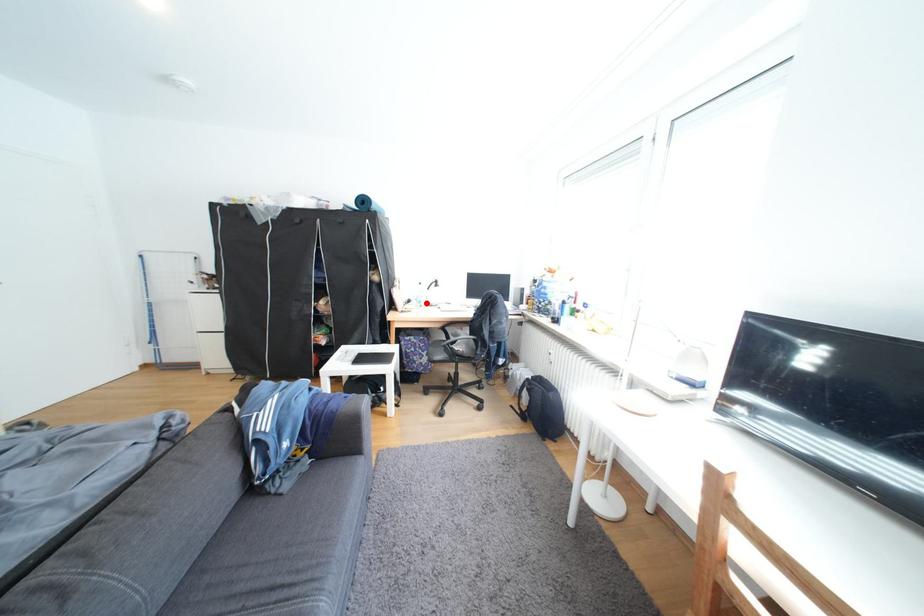
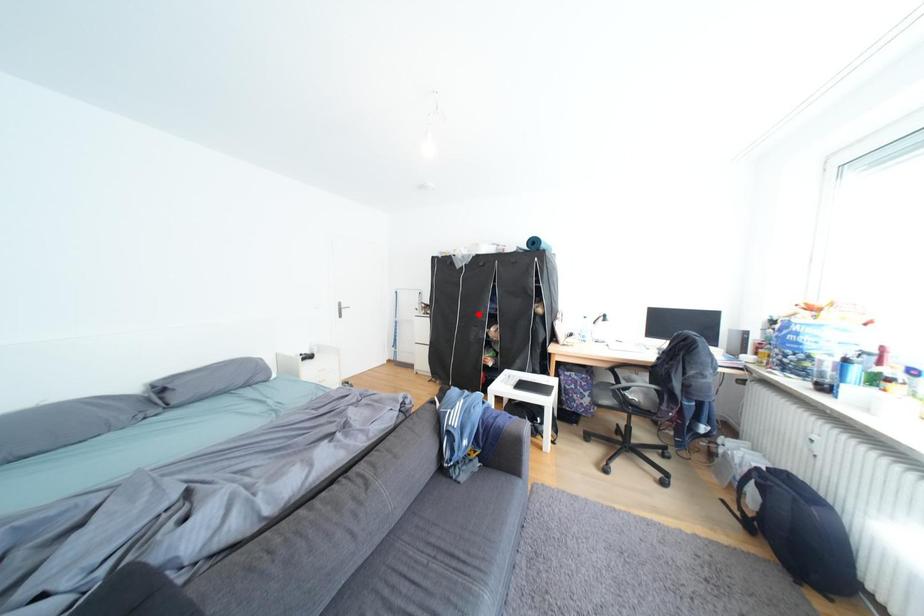
I am providing you with two images of the same scene from different viewpoints. A red point is marked on the first image and another point is marked on the second image. Is the red point in image1 aligned with the point shown in image2?

No